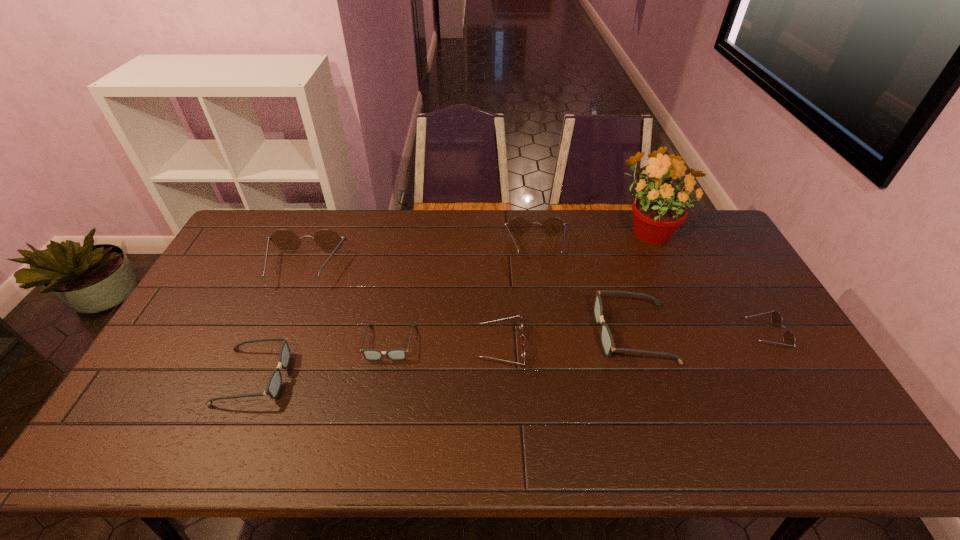
Identify the location of vacant space that's between the second smallest yellow spectacles and the third spectacles from left to right. The height and width of the screenshot is (540, 960). click(445, 345).

What are the coordinates of `vacant area that lies between the third biggest yellow spectacles and the tallest spectacles` in the screenshot? It's located at (403, 308).

Where is `free spot between the rightmost gray spectacles and the third biggest yellow spectacles`? The image size is (960, 540). free spot between the rightmost gray spectacles and the third biggest yellow spectacles is located at coordinates (567, 341).

This screenshot has height=540, width=960. What are the coordinates of `unoccupied area between the tallest spectacles and the leftmost gray spectacles` in the screenshot? It's located at (279, 322).

You are a GUI agent. You are given a task and a screenshot of the screen. Output one action in this format:
    pyautogui.click(x=<x>, y=<y>)
    Task: Click on the vacant space that's between the second gray spectacles from right to left and the rightmost object
    
    Given the screenshot: What is the action you would take?
    pyautogui.click(x=577, y=339)

You are a GUI agent. You are given a task and a screenshot of the screen. Output one action in this format:
    pyautogui.click(x=<x>, y=<y>)
    Task: Click on the empty space that is in between the third biggest yellow spectacles and the red flowerpot
    The image size is (960, 540).
    Given the screenshot: What is the action you would take?
    pyautogui.click(x=574, y=288)

Image resolution: width=960 pixels, height=540 pixels. Identify the location of empty space between the second smallest yellow spectacles and the second biggest gray spectacles. (378, 362).

The image size is (960, 540). I want to click on empty location between the leftmost gray spectacles and the flowerpot, so point(450,303).

The width and height of the screenshot is (960, 540). Identify the location of object that is the seventh nearest to the leftmost gray spectacles. (789, 339).

What are the coordinates of `object that is the fifth closest one to the second biggest yellow spectacles` in the screenshot? It's located at (789, 339).